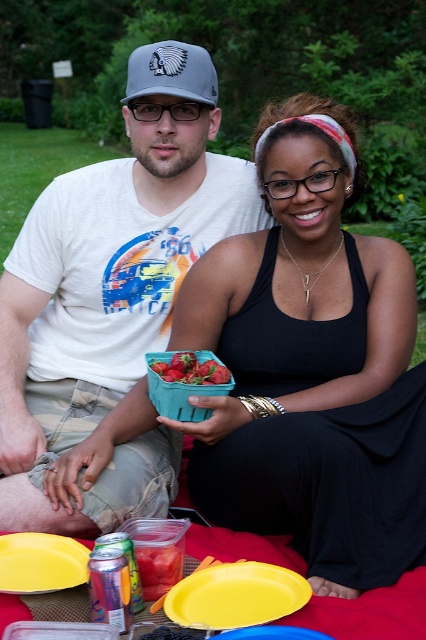
You are planning to place the ripe strawberry at center onto the yellow plastic plate at lower left. Considering their sizes, will the strawberry fit comfortably on the plate?

The yellow plastic plate at lower left is larger in size than the ripe strawberry at center, so the strawberry will fit comfortably on the plate.

You are standing at the picnic blanket and want to place a small gift between the two points, point (80, 564) and point (167, 364). Which point should you place it closer to so that it is in front of the other point?

You should place the gift closer to point (80, 564) because it is in front of point (167, 364), so placing it near that point will keep it in front.